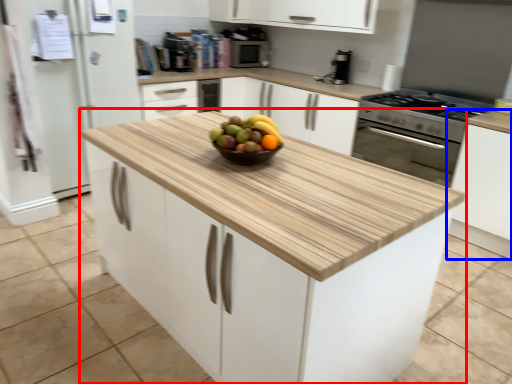
Question: Which of the following is the closest to the observer, cabinetry (highlighted by a red box) or cabinetry (highlighted by a blue box)?

Choices:
 (A) cabinetry
 (B) cabinetry

Answer: (A)